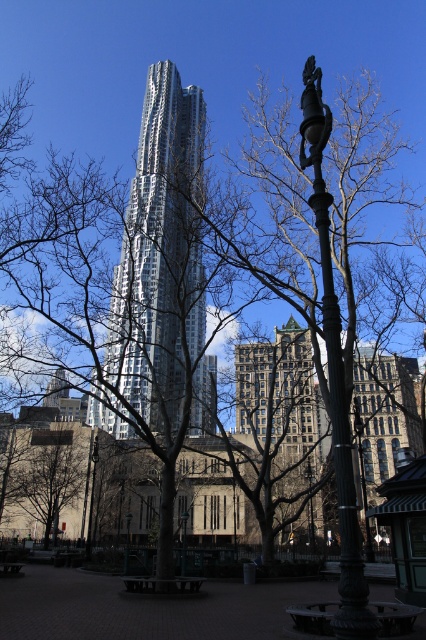
Does polished metal lamp post at center have a smaller size compared to green metallic lamp post at center?

Yes.

Does polished metal lamp post at center lie in front of green metallic lamp post at center?

That is True.

Is point (184, 540) positioned before point (126, 547)?

No, it is behind (126, 547).

This screenshot has width=426, height=640. I want to click on polished metal lamp post at center, so click(184, 541).

Is black polished metal lamp post at center bigger than green metallic lamp post at center?

Actually, black polished metal lamp post at center might be smaller than green metallic lamp post at center.

Image resolution: width=426 pixels, height=640 pixels. Describe the element at coordinates (92, 497) in the screenshot. I see `black polished metal lamp post at center` at that location.

Who is more distant from viewer, (86, 557) or (126, 520)?

The point (86, 557) is more distant.

Image resolution: width=426 pixels, height=640 pixels. I want to click on black polished metal lamp post at center, so click(x=92, y=497).

Is green patina metal lamp post at right taller than polished bronze lamp post at center?

Yes, green patina metal lamp post at right is taller than polished bronze lamp post at center.

Is point (321, 76) positioned behind point (307, 536)?

That is False.

Image resolution: width=426 pixels, height=640 pixels. I want to click on green patina metal lamp post at right, so click(334, 372).